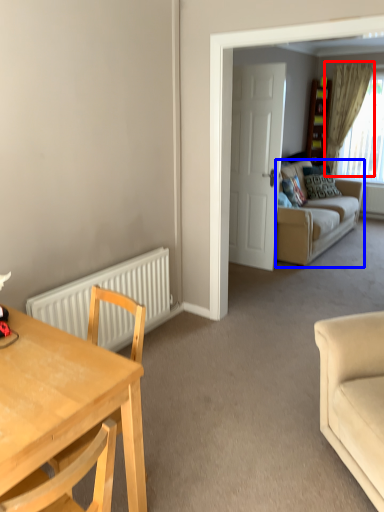
Question: Which object is closer to the camera taking this photo, curtain (highlighted by a red box) or studio couch (highlighted by a blue box)?

Choices:
 (A) curtain
 (B) studio couch

Answer: (B)